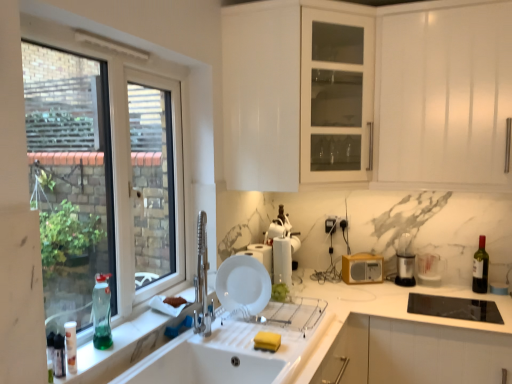
At what (x,y) coordinates should I click in order to perform the action: click on free location in front of green glass bottle at window, arranged as the second bottle when viewed from the right. Please return your answer as a coordinate pair (x, y). The height and width of the screenshot is (384, 512). Looking at the image, I should click on (87, 353).